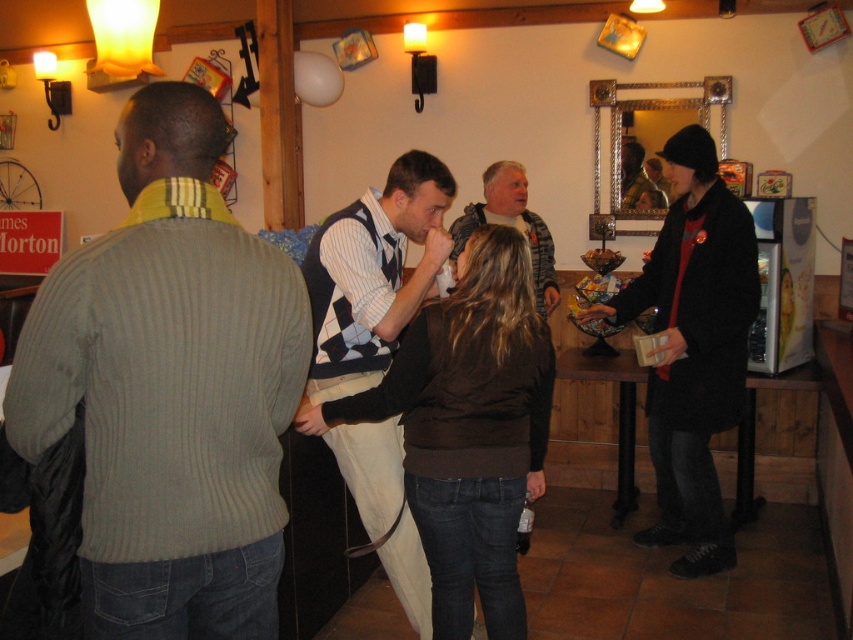
You are a photographer at the event and want to capture a photo that includes both the ribbed sweater at left and the gray sweater at center. The camera you are using has a maximum focus range of 8 feet. Will you be able to include both subjects in the same frame without moving closer?

The ribbed sweater at left is 7.84 feet away from the gray sweater at center. Since the distance between them is within the camera maximum focus range of 8 feet, you can include both subjects in the same frame without moving closer.

You are a photographer trying to capture both the brown sweater at center and the gray sweater at center in a single frame. Since the camera has a limited focus range, which sweater should you focus on first to ensure it appears clear in the photo?

The brown sweater at center is bigger than the gray sweater at center, so focusing on the brown sweater at center first would ensure it appears clear in the photo.

You are at a party and want to greet both the person wearing the brown sweater at center and the person wearing the gray sweater at center. Which one should you approach first if you want to start with the one on the left?

You should approach the brown sweater at center first because it is positioned to the left of the gray sweater at center.